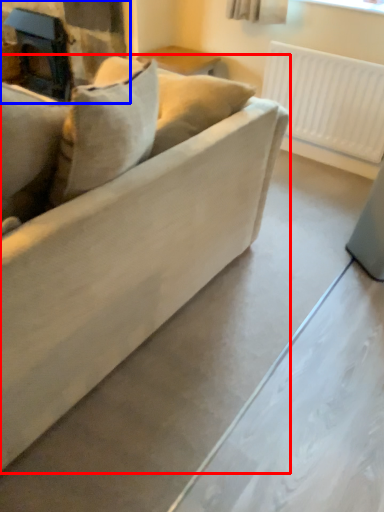
Question: Which object appears closest to the camera in this image, studio couch (highlighted by a red box) or fireplace (highlighted by a blue box)?

Choices:
 (A) studio couch
 (B) fireplace

Answer: (A)